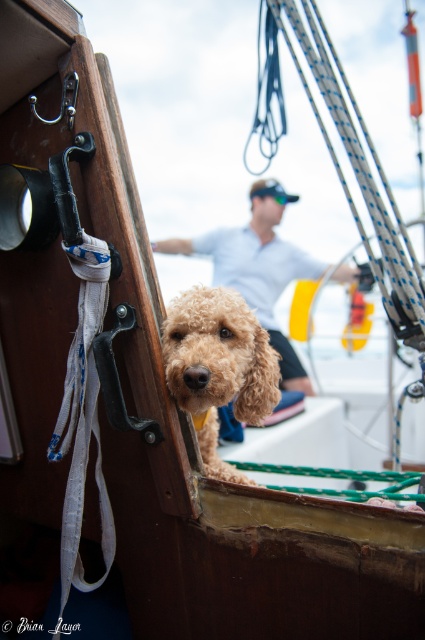
Can you confirm if fuzzy golden dog at center is positioned to the right of white cotton shirt at center?

No, fuzzy golden dog at center is not to the right of white cotton shirt at center.

Looking at this image, who is more distant from viewer, (x=229, y=328) or (x=257, y=216)?

Point (x=257, y=216)

Locate an element on the screen. fuzzy golden dog at center is located at coordinates (218, 365).